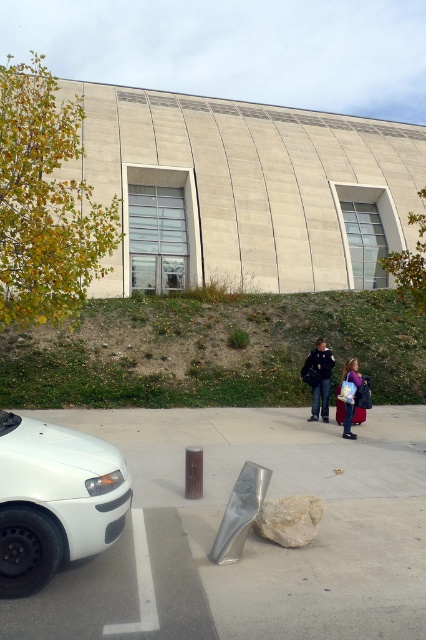
You are a visitor at the modern building and want to take a photo of the curved facade. You have a camera with a wide angle lens that can capture a large area. Which object between the green grassy hillside at lower left and the white matte car at lower left should you position closer to in order to include both the building and the object in the frame?

The green grassy hillside at lower left has a larger size compared to the white matte car at lower left. To include both the building and the object in the frame, you should position closer to the white matte car at lower left since it is smaller and would require less distance to capture both the building and the object in the wide angle lens.

You are a delivery person who needs to place a large package on the metallic silver pavement at lower center. However, there is a dark blue jacket at center in the way. Can you place the package there without moving the jacket?

The metallic silver pavement at lower center might be wider than dark blue jacket at center, so there might be enough space to place the package without moving the jacket.

You are a delivery person who needs to place a large package on the metallic silver pavement at lower center. However, there is a dark blue jacket at center in the way. Can you place the package there without moving the jacket?

The metallic silver pavement at lower center is not as tall as dark blue jacket at center, so the jacket is taller than the pavement. Since the jacket is taller, it is likely placed on top of the pavement. Therefore, you cannot place the package there without moving the jacket.